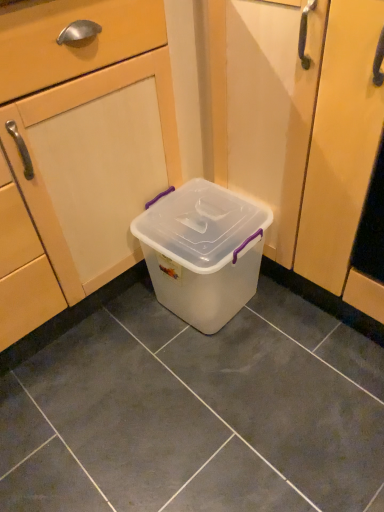
This screenshot has height=512, width=384. Identify the location of vacant space in front of transparent plastic storage box at center. (221, 382).